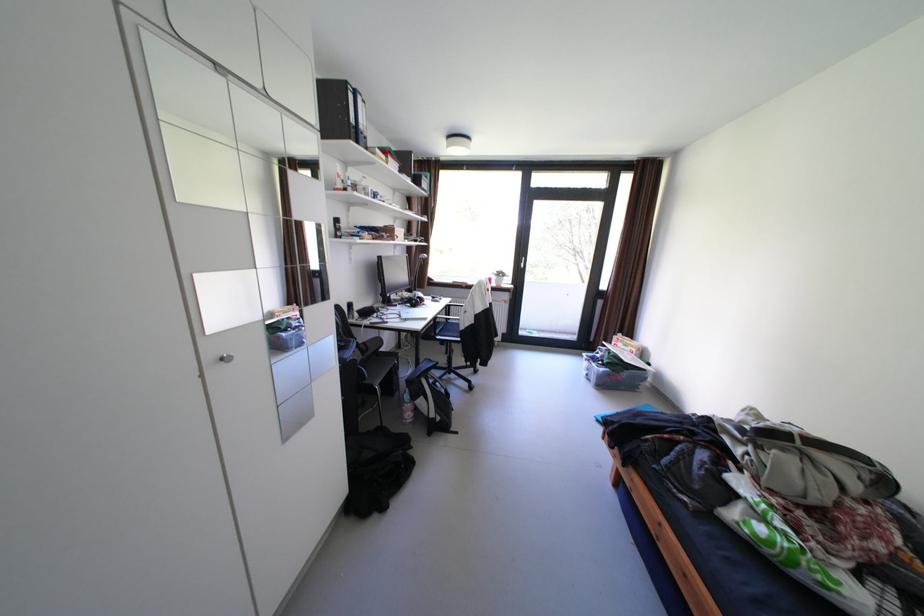
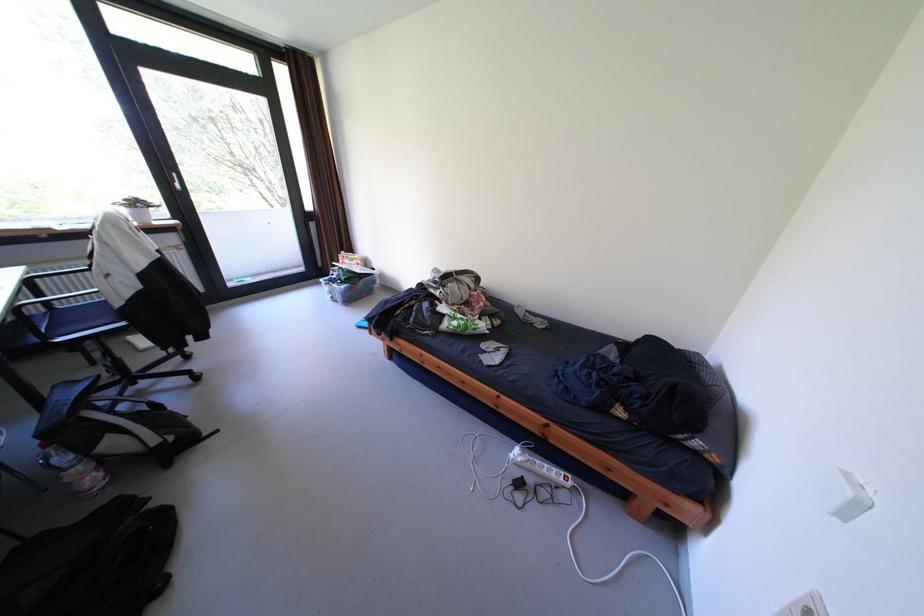
Locate, in the second image, the point that corresponds to pixel 890 546 in the first image.

(492, 304)